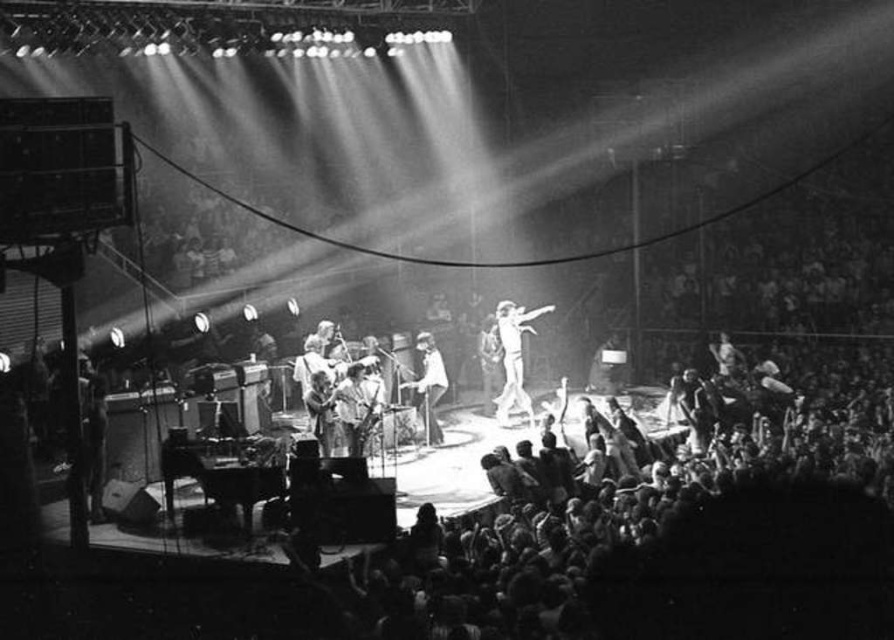
You are a photographer at the concert and want to capture a closeup of the white fabric outfit at center and the smooth white shirt at center. Which one should you zoom in on to ensure it fits entirely within the frame?

The white fabric outfit at center is smaller than the smooth white shirt at center, so you should zoom in on the white fabric outfit at center to ensure it fits entirely within the frame.

You are a photographer at the concert. You need to capture a photo where both the white fabric outfit at center and the smooth white shirt at center are visible. Which one will appear larger in the photo?

The white fabric outfit at center will appear larger in the photo because it is much taller than the smooth white shirt at center.